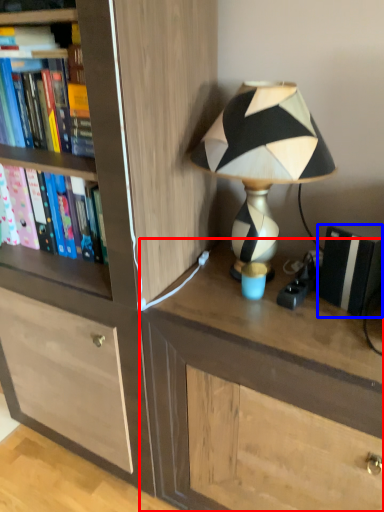
Question: Which object appears closest to the camera in this image, desk (highlighted by a red box) or paperback book (highlighted by a blue box)?

Choices:
 (A) desk
 (B) paperback book

Answer: (A)